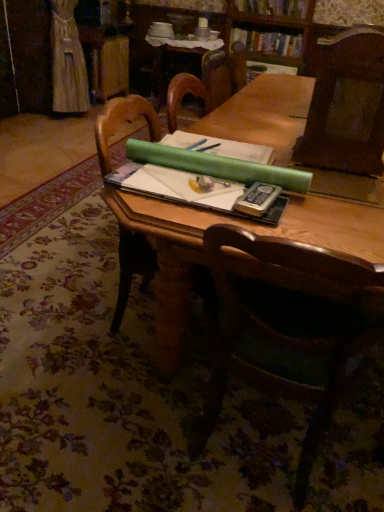
The image size is (384, 512). I want to click on vacant space to the left of dark wood chair at upper right, acting as the 2th chair starting from the bottom, so click(274, 148).